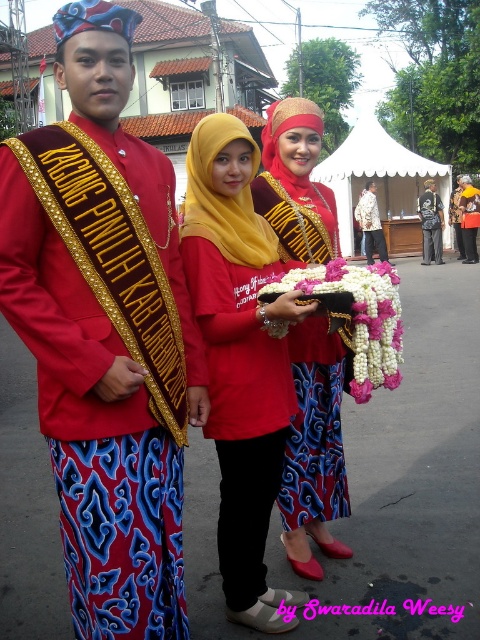
Question: Estimate the real-world distances between objects in this image. Which object is farther from the matte yellow hijab at center?

Choices:
 (A) pink fabric garland at center
 (B) yellow satin hijab at center
 (C) red satin sash at center

Answer: (B)

Question: Considering the relative positions of matte yellow hijab at center and yellow satin hijab at center in the image provided, where is matte yellow hijab at center located with respect to yellow satin hijab at center?

Choices:
 (A) below
 (B) above

Answer: (A)

Question: Does red satin sash at center appear under yellow satin hijab at center?

Choices:
 (A) no
 (B) yes

Answer: (B)

Question: Among these objects, which one is farthest from the camera?

Choices:
 (A) pink fabric garland at center
 (B) yellow satin hijab at center
 (C) red satin sash at center
 (D) matte red dress at center

Answer: (D)

Question: Estimate the real-world distances between objects in this image. Which object is farther from the pink fabric garland at center?

Choices:
 (A) dark gray fabric pants at center
 (B) yellow satin hijab at center
 (C) patterned fabric dress at center

Answer: (A)

Question: Observing the image, what is the correct spatial positioning of matte yellow hijab at center in reference to patterned fabric dress at center?

Choices:
 (A) left
 (B) right

Answer: (A)